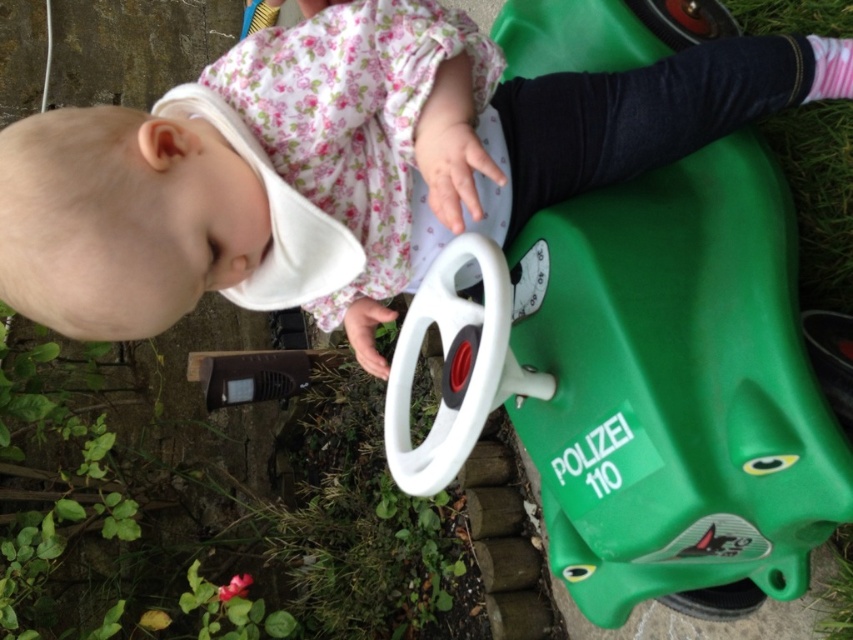
Question: Does green plastic toy car at lower right have a larger size compared to matte white bib at center?

Choices:
 (A) yes
 (B) no

Answer: (A)

Question: Among these points, which one is nearest to the camera?

Choices:
 (A) (573, 150)
 (B) (555, 397)

Answer: (B)

Question: Among these objects, which one is farthest from the camera?

Choices:
 (A) matte white bib at center
 (B) green plastic toy car at lower right

Answer: (B)

Question: Does green plastic toy car at lower right lie behind matte white bib at center?

Choices:
 (A) yes
 (B) no

Answer: (A)

Question: Can you confirm if green plastic toy car at lower right is bigger than matte white bib at center?

Choices:
 (A) yes
 (B) no

Answer: (A)